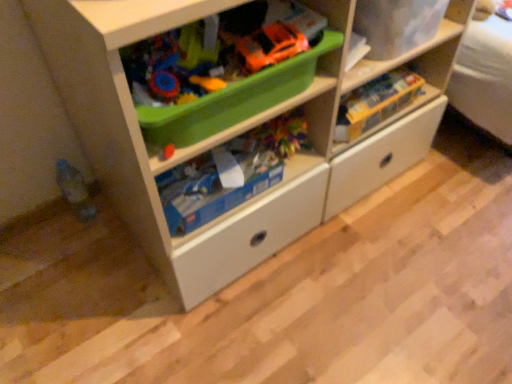
Identify the location of free space on the front side of white matte chest of drawers at center. (284, 313).